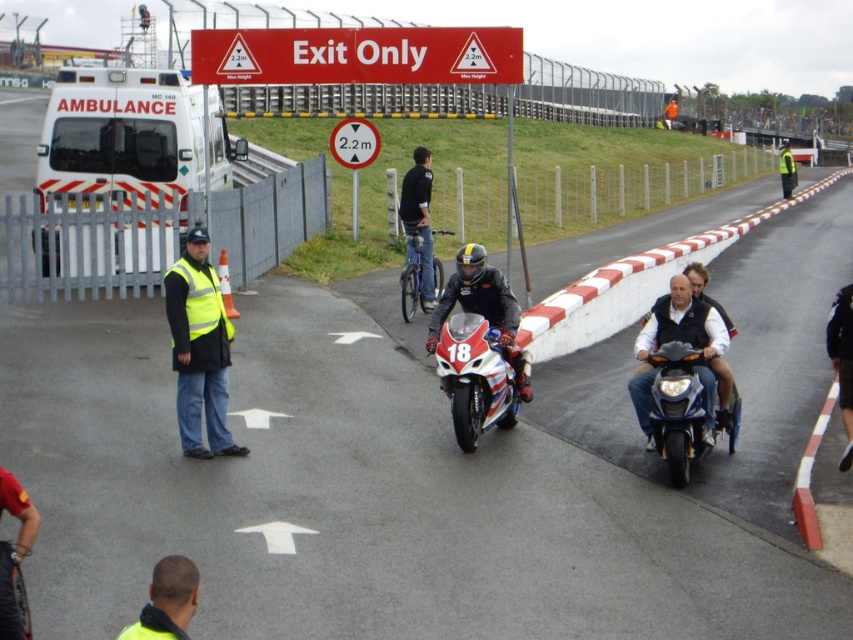
Question: Which of the following is the closest to the observer?

Choices:
 (A) white glossy motorcycle at center
 (B) shiny blue motorcycle at center
 (C) yellow reflective vest at lower center

Answer: (C)

Question: Can you confirm if white glossy motorcycle at center is positioned above shiny black motorcycle at center?

Choices:
 (A) no
 (B) yes

Answer: (A)

Question: Is matte black vest at center bigger than yellow reflective vest at lower center?

Choices:
 (A) no
 (B) yes

Answer: (B)

Question: Estimate the real-world distances between objects in this image. Which object is closer to the shiny black motorcycle at center?

Choices:
 (A) matte black vest at center
 (B) shiny blue motorcycle at center
 (C) white glossy motorcycle at center

Answer: (C)

Question: Observing the image, what is the correct spatial positioning of white matte ambulance at left in reference to shiny black motorcycle at center?

Choices:
 (A) below
 (B) above

Answer: (B)

Question: Which of these objects is positioned closest to the matte black vest at center?

Choices:
 (A) yellow reflective vest at center
 (B) black matte bicycle at center
 (C) yellow reflective vest at lower center

Answer: (A)